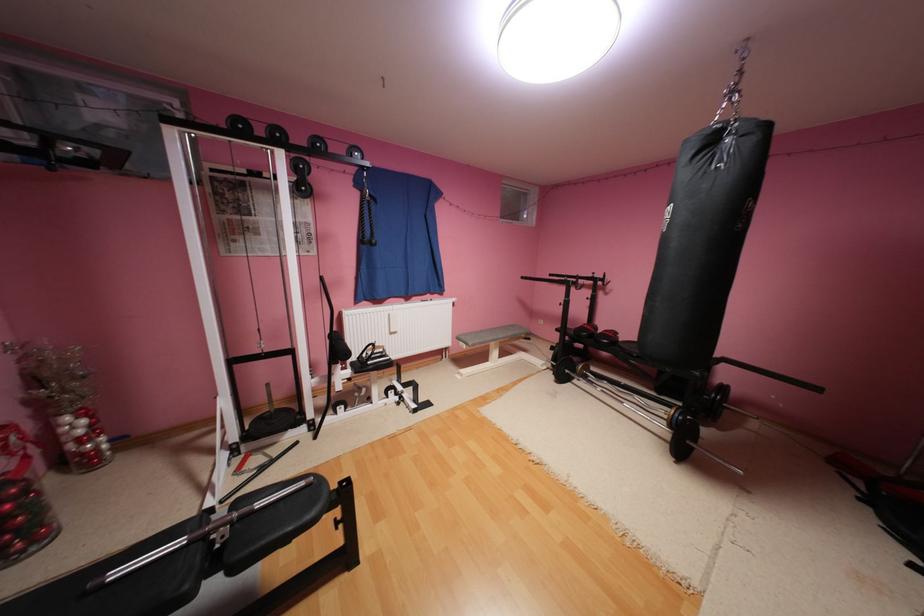
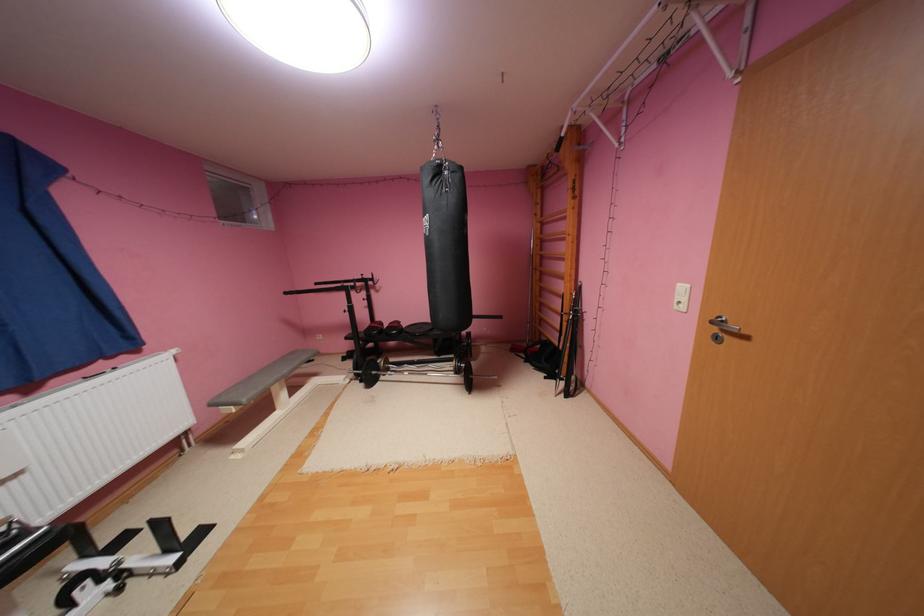
The point at (721,140) is marked in the first image. Where is the corresponding point in the second image?

(446, 171)